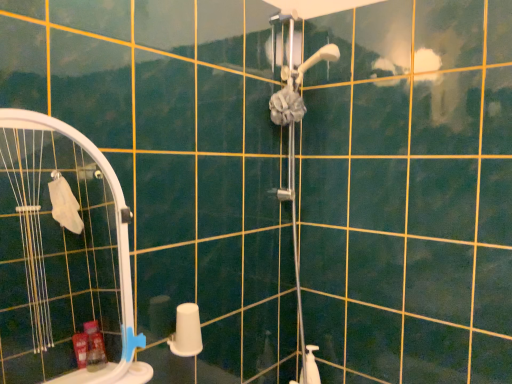
Question: Is point [x=184, y=319] closer or farther from the camera than point [x=102, y=319]?

Choices:
 (A) closer
 (B) farther

Answer: (A)

Question: Considering their positions, is white matte toilet paper at lower center located in front of or behind white plastic screen door at left?

Choices:
 (A) behind
 (B) front

Answer: (A)

Question: Considering the real-world distances, which object is closest to the blue plastic towel bar at lower left?

Choices:
 (A) white plastic screen door at left
 (B) matte gray shower door at upper center
 (C) white matte toilet paper at lower center

Answer: (C)

Question: Which object is positioned closest to the blue plastic towel bar at lower left?

Choices:
 (A) matte gray shower door at upper center
 (B) white plastic screen door at left
 (C) white matte toilet paper at lower center

Answer: (C)